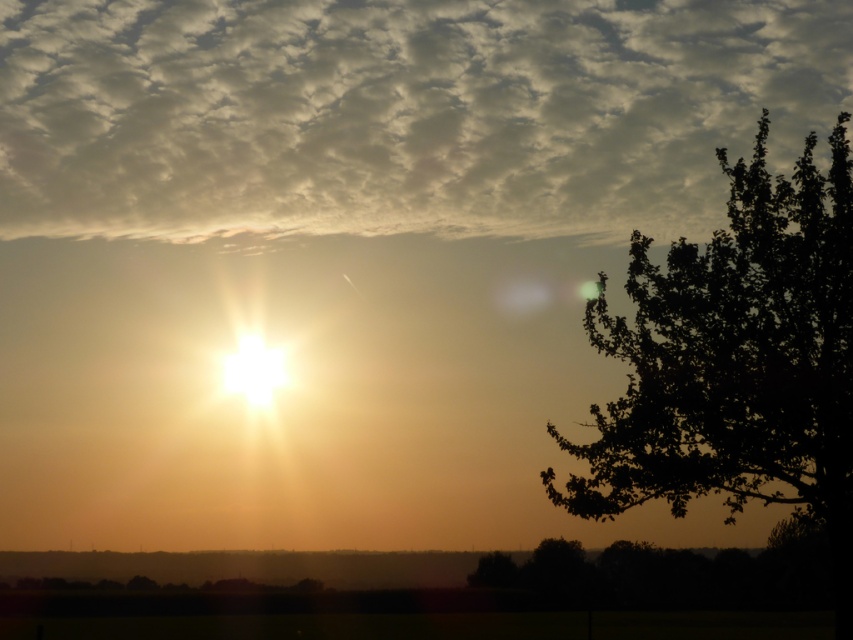
Which is below, cloudy sky at upper center or dark green leafy tree at right?

dark green leafy tree at right

Measure the distance between cloudy sky at upper center and dark green leafy tree at right.

The distance of cloudy sky at upper center from dark green leafy tree at right is 12.04 meters.

Between point (12, 22) and point (798, 296), which one is positioned behind?

The point (12, 22) is behind.

Image resolution: width=853 pixels, height=640 pixels. What are the coordinates of `cloudy sky at upper center` in the screenshot? It's located at (399, 113).